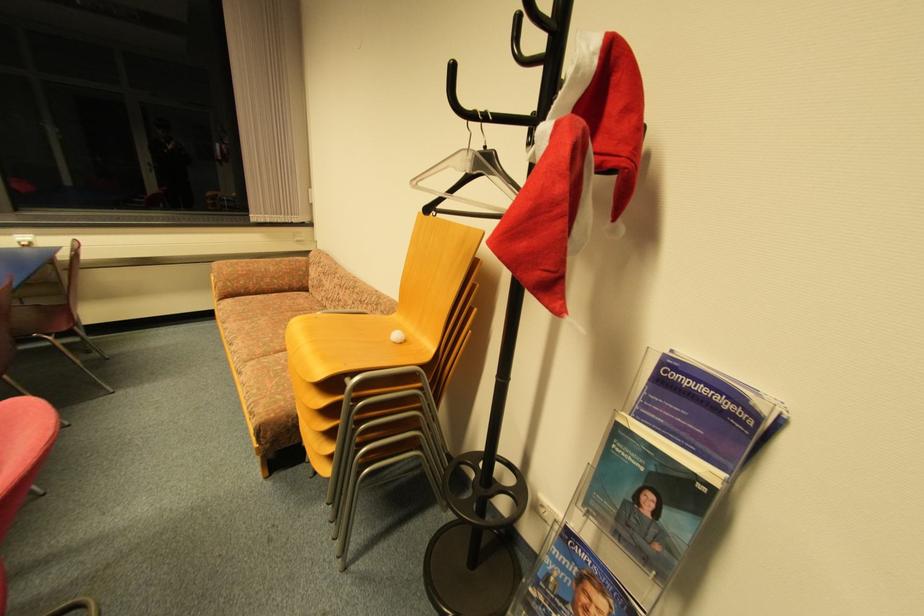
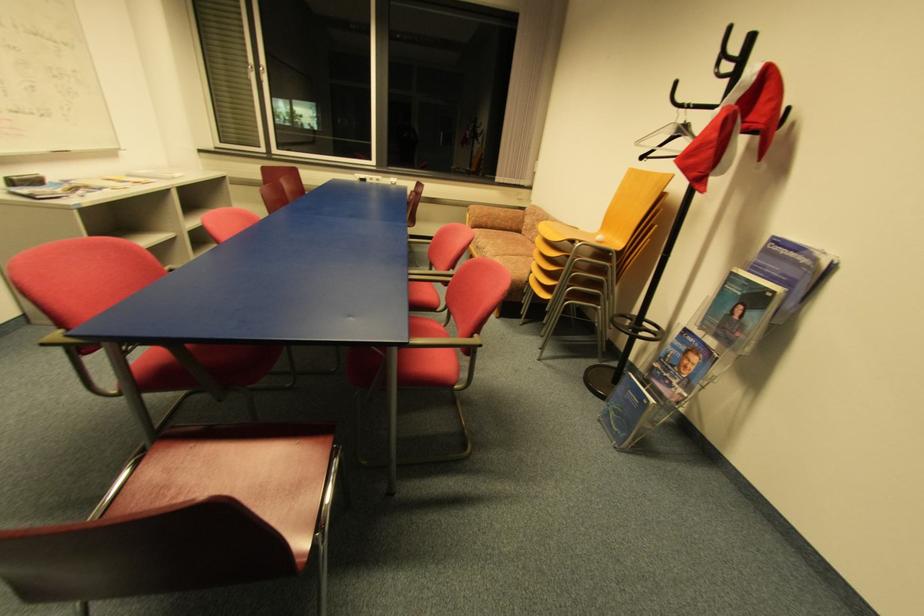
Question: The images are taken continuously from a first-person perspective. In which direction are you moving?

Choices:
 (A) Left
 (B) Right
 (C) Forward
 (D) Backward

Answer: (D)